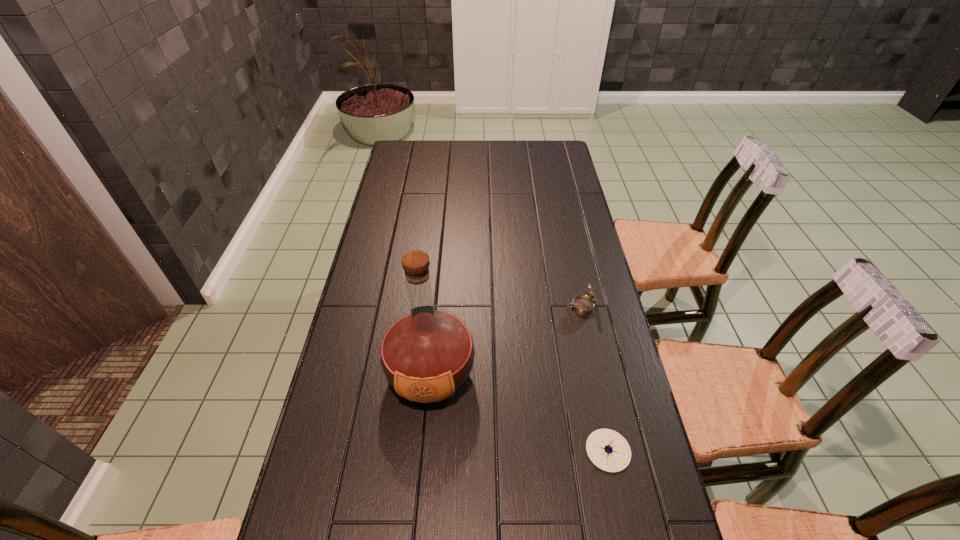
This screenshot has width=960, height=540. Identify the location of free space between the nearest object and the second shortest object. (595, 379).

This screenshot has width=960, height=540. I want to click on unoccupied position between the liquor and the nearer compass, so click(519, 412).

You are a GUI agent. You are given a task and a screenshot of the screen. Output one action in this format:
    pyautogui.click(x=<x>, y=<y>)
    Task: Click on the free area in between the farthest object and the leftmost object
    This screenshot has height=540, width=960.
    Given the screenshot: What is the action you would take?
    coord(506,340)

At what (x,y) coordinates should I click in order to perform the action: click on free space between the second tallest object and the tallest object. Please return your answer as a coordinate pair (x, y). The height and width of the screenshot is (540, 960). Looking at the image, I should click on (506, 340).

At what (x,y) coordinates should I click in order to perform the action: click on empty space that is in between the leftmost object and the farthest object. Please return your answer as a coordinate pair (x, y). Image resolution: width=960 pixels, height=540 pixels. Looking at the image, I should click on (506, 340).

Locate an element on the screen. The height and width of the screenshot is (540, 960). free space between the second nearest object and the shortest object is located at coordinates click(519, 412).

What are the coordinates of `object that is the closest to the shorter compass` in the screenshot? It's located at (427, 354).

Locate which object is the closest to the farthest object. Please provide its 2D coordinates. Your answer should be formatted as a tuple, i.e. [(x, y)], where the tuple contains the x and y coordinates of a point satisfying the conditions above.

[(427, 354)]

The width and height of the screenshot is (960, 540). I want to click on vacant space that satisfies the following two spatial constraints: 1. with the dial facing the farther compass; 2. on the front label of the liquor, so click(596, 374).

Identify the location of free spot that satisfies the following two spatial constraints: 1. on the front label of the shortest object; 2. on the left side of the second farthest object. (423, 450).